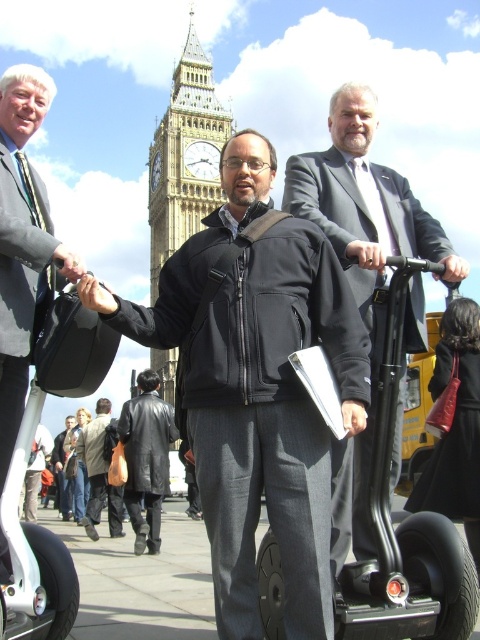
Question: Which object appears farthest from the camera in this image?

Choices:
 (A) golden stone clock tower at center
 (B) light gray suit at left

Answer: (A)

Question: Is black softshell jacket at center closer to the viewer compared to golden stone clock tower at center?

Choices:
 (A) no
 (B) yes

Answer: (B)

Question: Does light gray suit at left appear on the left side of light brown leather jacket at lower left?

Choices:
 (A) no
 (B) yes

Answer: (B)

Question: Based on their relative distances, which object is nearer to the leather jacket at center?

Choices:
 (A) light gray suit at left
 (B) dark gray suit at center

Answer: (A)

Question: Is golden stone clock tower at center above light brown leather jacket at lower left?

Choices:
 (A) yes
 (B) no

Answer: (A)

Question: Which point is farther to the camera?

Choices:
 (A) dark gray suit at center
 (B) black softshell jacket at center
 (C) golden stone clock tower at center
 (D) light brown leather jacket at lower left

Answer: (D)